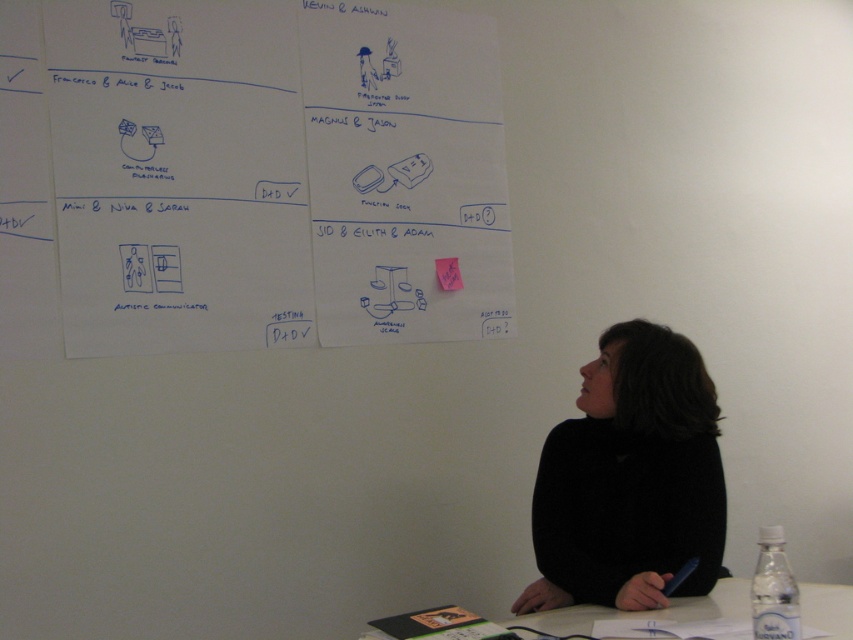
You are organizing a presentation and need to place a name tag on the table. The name tag is the size of the pink paper at center. Can the black matte sweater at lower right cover the name tag completely?

The black matte sweater at lower right is larger in size than the pink paper at center. Therefore, the sweater can completely cover the name tag if placed over it.

You are a guest at a meeting and need to place your notebook on the table. The notebook is 12 inches wide. Can you place it on the white plastic table at lower center without overlapping the black matte sweater at lower right?

The black matte sweater at lower right is positioned on the left side of white plastic table at lower center. Since the sweater is on the left side of the table, placing the notebook on the right side of the table would avoid overlapping it. Therefore, the notebook can be placed on the white plastic table at lower center without overlapping the black matte sweater at lower right.